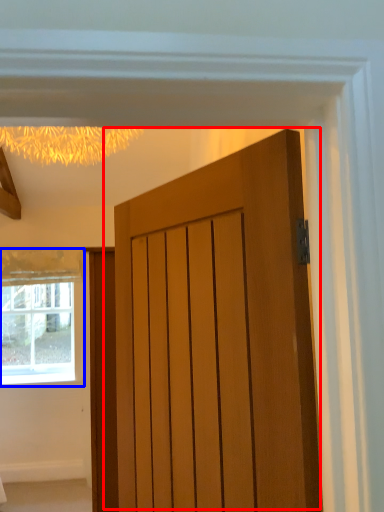
Question: Which of the following is the closest to the observer, door (highlighted by a red box) or window (highlighted by a blue box)?

Choices:
 (A) door
 (B) window

Answer: (A)